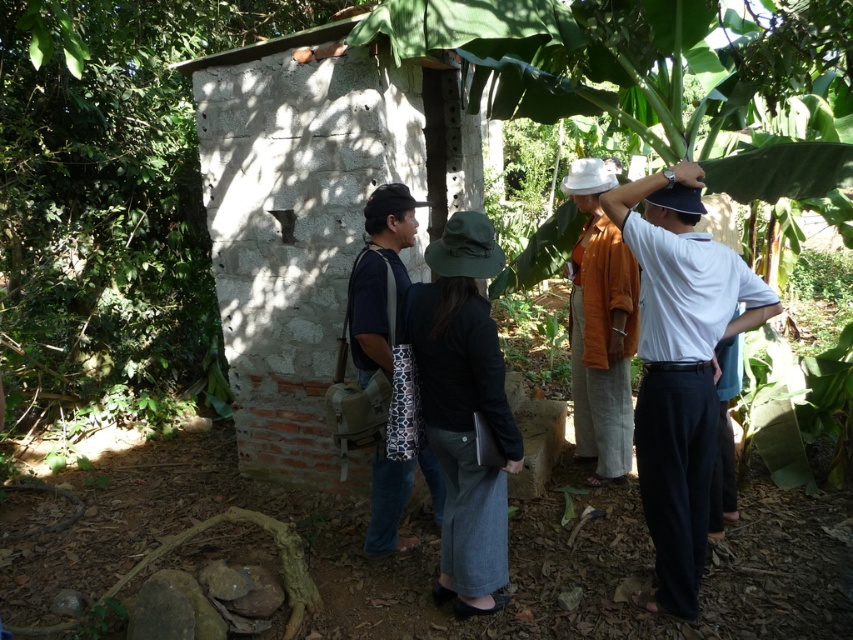
Which of these two, white matte shirt at center or dark blue jeans at center, stands shorter?

dark blue jeans at center

Is white matte shirt at center taller than dark blue jeans at center?

Yes, white matte shirt at center is taller than dark blue jeans at center.

Is point (709, 422) farther from viewer compared to point (380, 253)?

No, (709, 422) is in front of (380, 253).

At what (x,y) coordinates should I click in order to perform the action: click on white matte shirt at center. Please return your answer as a coordinate pair (x, y). Looking at the image, I should click on (679, 365).

The width and height of the screenshot is (853, 640). What do you see at coordinates (463, 410) in the screenshot? I see `denim skirt at center` at bounding box center [463, 410].

Describe the element at coordinates (463, 410) in the screenshot. The width and height of the screenshot is (853, 640). I see `denim skirt at center` at that location.

You are a GUI agent. You are given a task and a screenshot of the screen. Output one action in this format:
    pyautogui.click(x=<x>, y=<y>)
    Task: Click on the denim skirt at center
    This screenshot has height=640, width=853.
    Given the screenshot: What is the action you would take?
    pyautogui.click(x=463, y=410)

Does white matte shirt at center have a lesser height compared to denim skirt at center?

In fact, white matte shirt at center may be taller than denim skirt at center.

Can you confirm if white matte shirt at center is bigger than denim skirt at center?

Yes, white matte shirt at center is bigger than denim skirt at center.

Which is in front, point (657, 461) or point (463, 449)?

Positioned in front is point (657, 461).

Identify the location of white matte shirt at center. The image size is (853, 640). (679, 365).